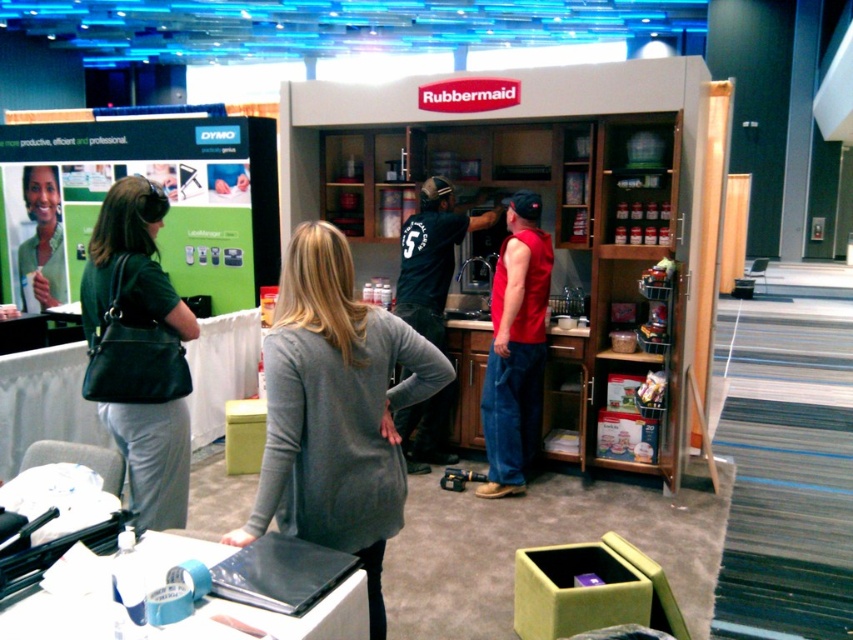
Question: Which point is closer to the camera?

Choices:
 (A) gray sweater at center
 (B) red sleeveless shirt at center
 (C) black leather purse at left

Answer: (A)

Question: Which object is closer to the camera taking this photo?

Choices:
 (A) gray sweater at center
 (B) green matte shirt at upper left
 (C) black leather purse at left
 (D) red sleeveless shirt at center

Answer: (A)

Question: Which point appears farthest from the camera in this image?

Choices:
 (A) (277, 451)
 (B) (502, 314)

Answer: (B)

Question: In this image, where is gray sweater at center located relative to red sleeveless shirt at center?

Choices:
 (A) right
 (B) left

Answer: (B)

Question: Does gray sweater at center have a smaller size compared to red sleeveless shirt at center?

Choices:
 (A) yes
 (B) no

Answer: (A)

Question: Does gray sweater at center appear on the left side of black leather purse at left?

Choices:
 (A) yes
 (B) no

Answer: (B)